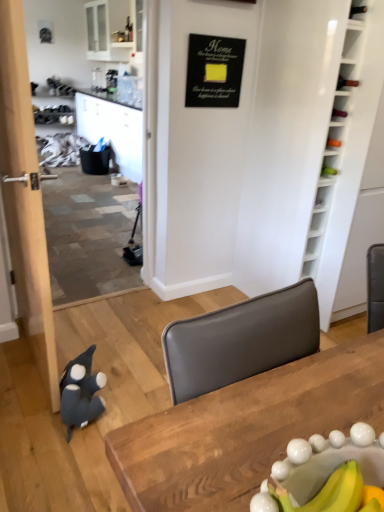
Question: Considering the relative positions of white wood bookshelf at right and black matte signboard at upper center in the image provided, is white wood bookshelf at right behind black matte signboard at upper center?

Choices:
 (A) no
 (B) yes

Answer: (A)

Question: From a real-world perspective, does white wood bookshelf at right stand above black matte signboard at upper center?

Choices:
 (A) no
 (B) yes

Answer: (A)

Question: Considering the relative sizes of white wood bookshelf at right and black matte signboard at upper center in the image provided, is white wood bookshelf at right bigger than black matte signboard at upper center?

Choices:
 (A) no
 (B) yes

Answer: (B)

Question: Could black matte signboard at upper center be considered to be inside white wood bookshelf at right?

Choices:
 (A) yes
 (B) no

Answer: (B)

Question: Can you confirm if white wood bookshelf at right is wider than black matte signboard at upper center?

Choices:
 (A) yes
 (B) no

Answer: (A)

Question: Does white wood bookshelf at right appear on the left side of black matte signboard at upper center?

Choices:
 (A) yes
 (B) no

Answer: (B)

Question: From the image's perspective, is white wood bookshelf at right under wooden table at center?

Choices:
 (A) no
 (B) yes

Answer: (A)

Question: Is white wood bookshelf at right turned away from wooden table at center?

Choices:
 (A) yes
 (B) no

Answer: (B)

Question: Would you say wooden table at center is part of white wood bookshelf at right's contents?

Choices:
 (A) no
 (B) yes

Answer: (A)

Question: Is there a large distance between white wood bookshelf at right and wooden table at center?

Choices:
 (A) no
 (B) yes

Answer: (B)

Question: From the image's perspective, is white wood bookshelf at right over wooden table at center?

Choices:
 (A) no
 (B) yes

Answer: (B)

Question: Is white wood bookshelf at right not within wooden table at center?

Choices:
 (A) yes
 (B) no

Answer: (A)

Question: Does white wood bookshelf at right come behind dark gray plush penguin at lower left?

Choices:
 (A) no
 (B) yes

Answer: (B)